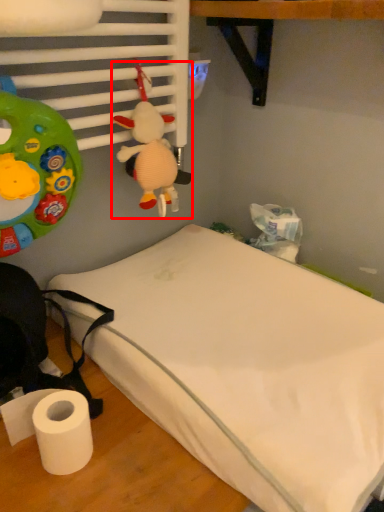
Question: From the image's perspective, considering the relative positions of toy (annotated by the red box) and bed in the image provided, where is toy (annotated by the red box) located with respect to the staircase?

Choices:
 (A) above
 (B) below

Answer: (A)